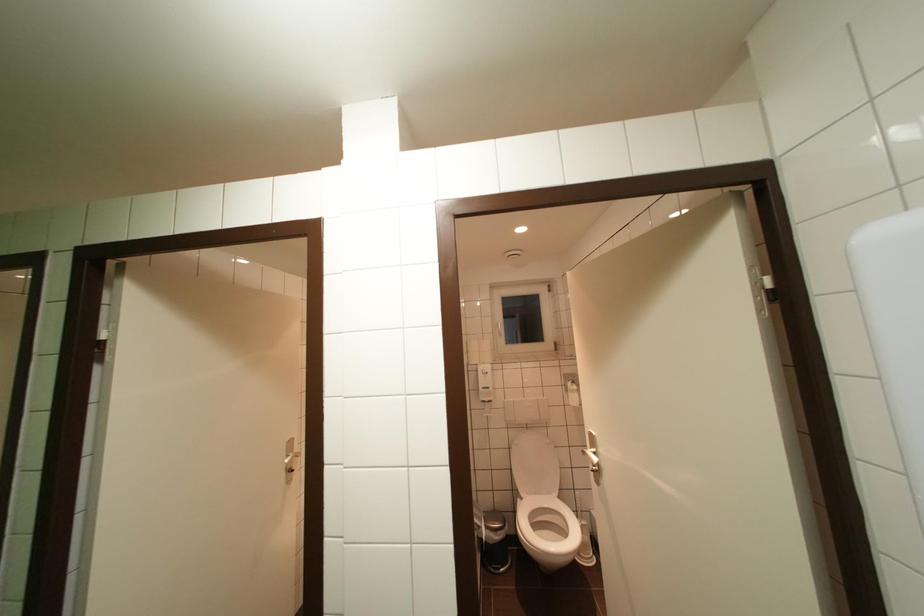
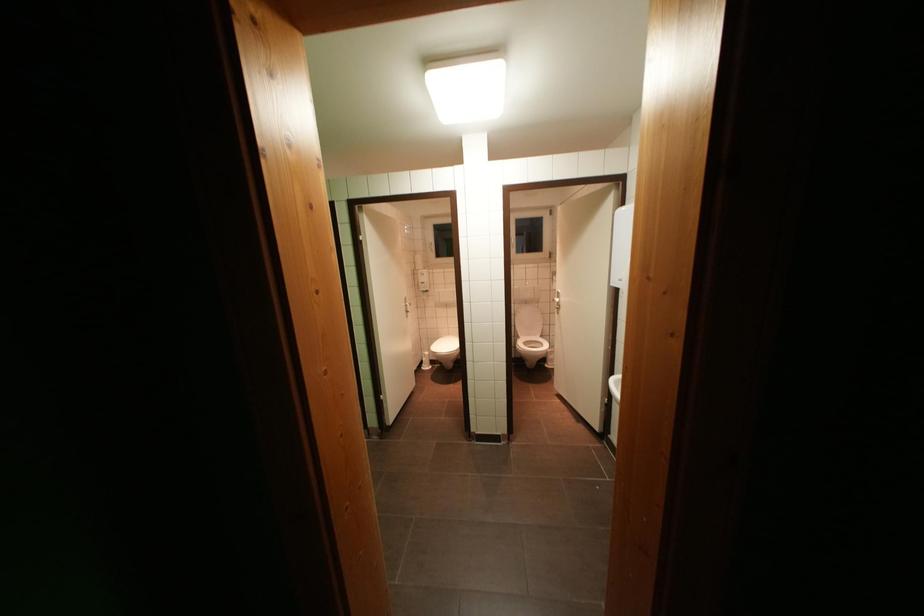
Question: Which direction would the cameraman need to move to produce the second image? Reply with the corresponding letter.

Choices:
 (A) Left
 (B) Right
 (C) Forward
 (D) Backward

Answer: (D)